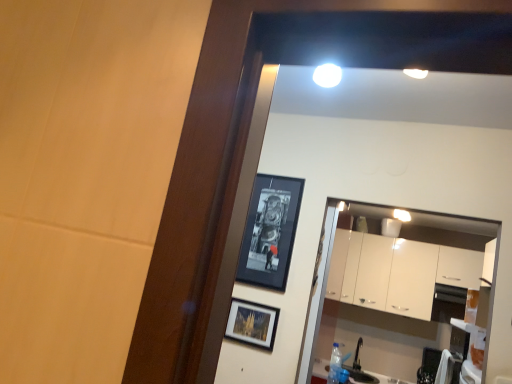
Question: Which direction should I rotate to look at matte black picture frame at center, placed as the first picture frame when sorted from bottom to top, — up or down?

Choices:
 (A) down
 (B) up

Answer: (A)

Question: Considering the relative positions of matte black picture frame at center, placed as the first picture frame when sorted from bottom to top, and black glossy picture frame at upper center, the first picture frame from the top, in the image provided, is matte black picture frame at center, placed as the first picture frame when sorted from bottom to top, in front of black glossy picture frame at upper center, the first picture frame from the top,?

Choices:
 (A) yes
 (B) no

Answer: (A)

Question: From a real-world perspective, is matte black picture frame at center, the second picture frame from the top, on black glossy picture frame at upper center, the first picture frame from the top?

Choices:
 (A) no
 (B) yes

Answer: (A)

Question: Is matte black picture frame at center, the second picture frame from the top, wider than black glossy picture frame at upper center, which is counted as the second picture frame, starting from the bottom?

Choices:
 (A) yes
 (B) no

Answer: (A)

Question: Is matte black picture frame at center, the second picture frame from the top, directly adjacent to black glossy picture frame at upper center, the first picture frame from the top?

Choices:
 (A) yes
 (B) no

Answer: (B)

Question: Considering the relative positions of matte black picture frame at center, placed as the first picture frame when sorted from bottom to top, and black glossy picture frame at upper center, the first picture frame from the top, in the image provided, is matte black picture frame at center, placed as the first picture frame when sorted from bottom to top, to the left of black glossy picture frame at upper center, the first picture frame from the top, from the viewer's perspective?

Choices:
 (A) no
 (B) yes

Answer: (B)

Question: Can you confirm if matte black picture frame at center, the second picture frame from the top, is bigger than black glossy picture frame at upper center, which is counted as the second picture frame, starting from the bottom?

Choices:
 (A) yes
 (B) no

Answer: (B)

Question: Is white glossy cabinets at center oriented away from black glossy picture frame at upper center, which is counted as the second picture frame, starting from the bottom?

Choices:
 (A) no
 (B) yes

Answer: (A)

Question: Considering the relative sizes of white glossy cabinets at center and black glossy picture frame at upper center, which is counted as the second picture frame, starting from the bottom, in the image provided, is white glossy cabinets at center taller than black glossy picture frame at upper center, which is counted as the second picture frame, starting from the bottom,?

Choices:
 (A) no
 (B) yes

Answer: (B)

Question: Considering the relative sizes of white glossy cabinets at center and black glossy picture frame at upper center, the first picture frame from the top, in the image provided, is white glossy cabinets at center smaller than black glossy picture frame at upper center, the first picture frame from the top,?

Choices:
 (A) yes
 (B) no

Answer: (B)

Question: From the image's perspective, is white glossy cabinets at center located above black glossy picture frame at upper center, the first picture frame from the top?

Choices:
 (A) no
 (B) yes

Answer: (A)

Question: Is white glossy cabinets at center bigger than black glossy picture frame at upper center, which is counted as the second picture frame, starting from the bottom?

Choices:
 (A) yes
 (B) no

Answer: (A)

Question: Does white glossy cabinets at center have a lesser width compared to black glossy picture frame at upper center, the first picture frame from the top?

Choices:
 (A) no
 (B) yes

Answer: (A)

Question: Is black glossy picture frame at upper center, which is counted as the second picture frame, starting from the bottom, at the left side of white glossy cabinets at center?

Choices:
 (A) yes
 (B) no

Answer: (A)